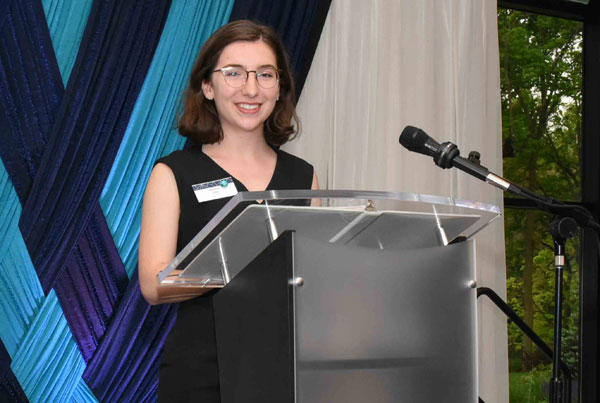
Identify the location of hardcover book. (246, 248), (311, 220), (350, 230), (404, 226), (422, 237).